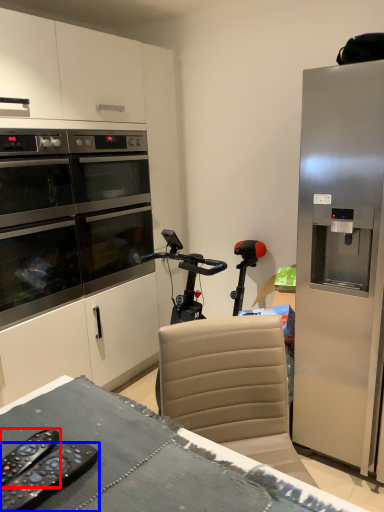
Question: Which point is closer to the camera, remote control (highlighted by a red box) or remote control (highlighted by a blue box)?

Choices:
 (A) remote control
 (B) remote control

Answer: (B)